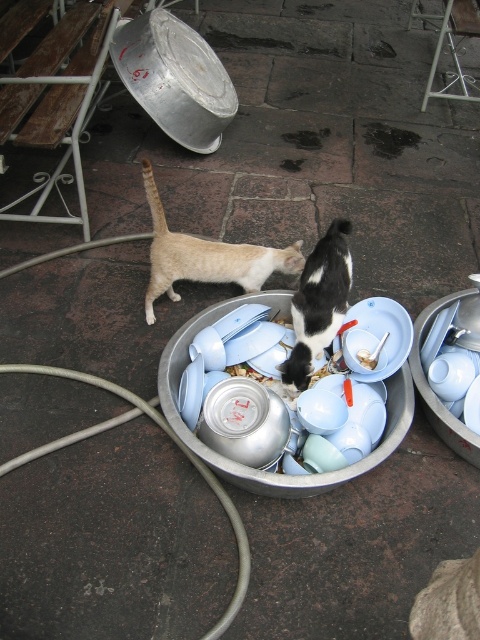
What do you see at coordinates (319, 304) in the screenshot?
I see `black-and-white fur cat at center` at bounding box center [319, 304].

Where is `black-and-white fur cat at center`? black-and-white fur cat at center is located at coordinates (319, 304).

Find the location of a particular element. black-and-white fur cat at center is located at coordinates (319, 304).

Can you confirm if light brown fur at center is positioned above orange plastic spoon at center?

Correct, light brown fur at center is located above orange plastic spoon at center.

Is light brown fur at center to the left of orange plastic spoon at center from the viewer's perspective?

Indeed, light brown fur at center is positioned on the left side of orange plastic spoon at center.

I want to click on light brown fur at center, so click(x=205, y=257).

Between light brown fur at center and black-and-white fur cat at center, which one has more height?

Standing taller between the two is black-and-white fur cat at center.

Locate an element on the screen. light brown fur at center is located at coordinates (205, 257).

Does point (149, 291) lie behind point (340, 260)?

Yes.

This screenshot has width=480, height=640. I want to click on light brown fur at center, so click(205, 257).